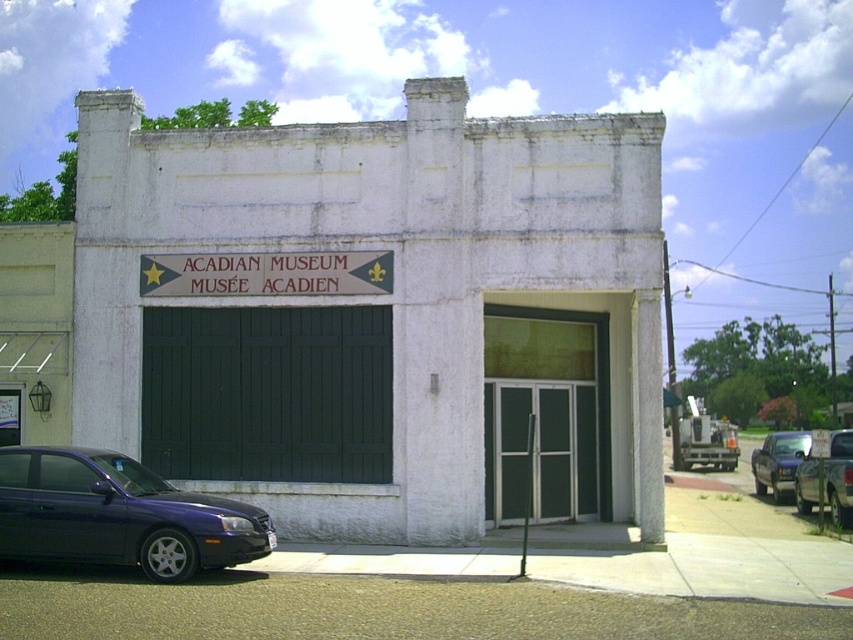
Who is higher up, dark green wooden garage door at center or metallic blue sedan at center?

Positioned higher is dark green wooden garage door at center.

Who is more forward, (149, 435) or (773, 456)?

Point (149, 435) is in front.

At what (x,y) coordinates should I click in order to perform the action: click on dark green wooden garage door at center. Please return your answer as a coordinate pair (x, y). The height and width of the screenshot is (640, 853). Looking at the image, I should click on (267, 394).

Which of these two, white wooden sign at center or metallic silver truck at lower right, stands shorter?

Standing shorter between the two is white wooden sign at center.

In the scene shown: Is white wooden sign at center to the left of metallic silver truck at lower right from the viewer's perspective?

Correct, you'll find white wooden sign at center to the left of metallic silver truck at lower right.

Which is behind, point (274, 276) or point (850, 456)?

The point (850, 456) is more distant.

Where is `white wooden sign at center`? white wooden sign at center is located at coordinates (265, 273).

Which is more to the left, metallic silver truck at lower right or metallic blue sedan at center?

From the viewer's perspective, metallic silver truck at lower right appears more on the left side.

Is point (805, 513) farther from viewer compared to point (751, 458)?

No, (805, 513) is closer to viewer.

Describe the element at coordinates (827, 480) in the screenshot. I see `metallic silver truck at lower right` at that location.

The image size is (853, 640). Identify the location of metallic silver truck at lower right. (827, 480).